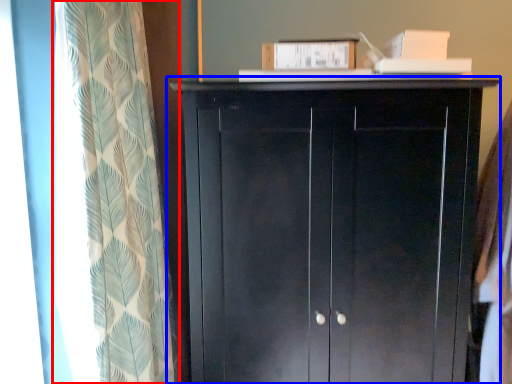
Question: Which object is further to the camera taking this photo, curtain (highlighted by a red box) or cupboard (highlighted by a blue box)?

Choices:
 (A) curtain
 (B) cupboard

Answer: (B)